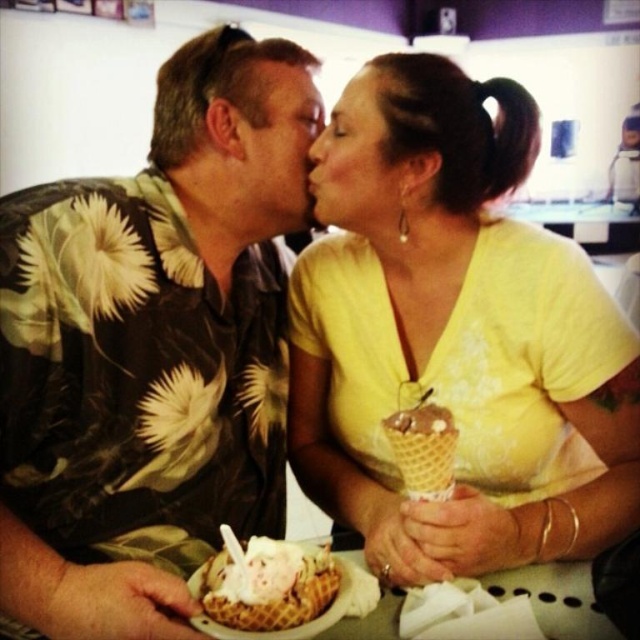
You are designing a layout for a magazine spread and need to place two elements based on their widths. The yellow matte shirt at center and the matte skin forehead at center are both in the same scene. Which object should you allocate more horizontal space to in your design to maintain visual accuracy?

The yellow matte shirt at center should be allocated more horizontal space because its width surpasses that of the matte skin forehead at center.

You are standing in the cafe and want to place a small decoration between the two points, point (488, 259) and point (269, 120). To ensure it is visible to most customers, should you place it closer to which point?

You should place the decoration closer to point (488, 259) because it is closer to the viewer, making the decoration more visible to customers.